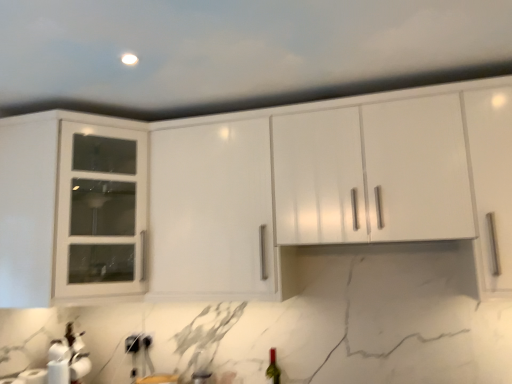
Question: From the image's perspective, is green glass wine bottle at lower center above or below white glass cabinet at upper left?

Choices:
 (A) above
 (B) below

Answer: (B)

Question: Looking at their shapes, would you say green glass wine bottle at lower center is wider or thinner than white glass cabinet at upper left?

Choices:
 (A) wide
 (B) thin

Answer: (B)

Question: Considering the real-world distances, which object is closest to the white matte paper towel at lower left?

Choices:
 (A) white glass cabinet at upper left
 (B) green glass wine bottle at lower center

Answer: (A)

Question: Estimate the real-world distances between objects in this image. Which object is farther from the white glass cabinet at upper left?

Choices:
 (A) white matte paper towel at lower left
 (B) green glass wine bottle at lower center

Answer: (B)